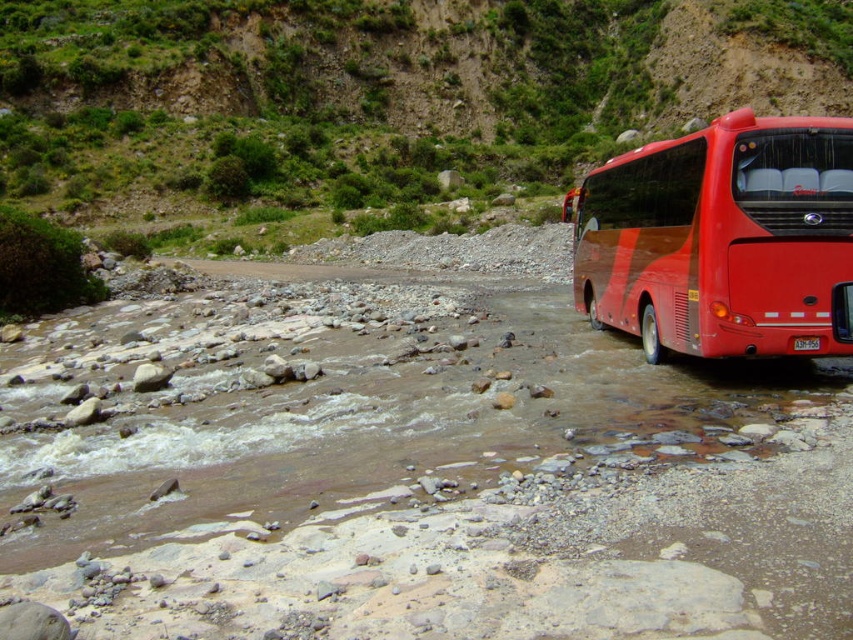
Question: Which object appears closest to the camera in this image?

Choices:
 (A) dirt/gravel path at center
 (B) green grassy hillside at upper center
 (C) red glossy bus at right

Answer: (C)

Question: Is green grassy hillside at upper center above red glossy bus at right?

Choices:
 (A) no
 (B) yes

Answer: (B)

Question: Is red glossy bus at right below dirt/gravel path at center?

Choices:
 (A) yes
 (B) no

Answer: (A)

Question: Among these objects, which one is farthest from the camera?

Choices:
 (A) red glossy bus at right
 (B) green grassy hillside at upper center
 (C) dirt/gravel path at center

Answer: (B)

Question: In this image, where is green grassy hillside at upper center located relative to dirt/gravel path at center?

Choices:
 (A) below
 (B) above

Answer: (B)

Question: Based on their relative distances, which object is nearer to the dirt/gravel path at center?

Choices:
 (A) green grassy hillside at upper center
 (B) red glossy bus at right

Answer: (B)